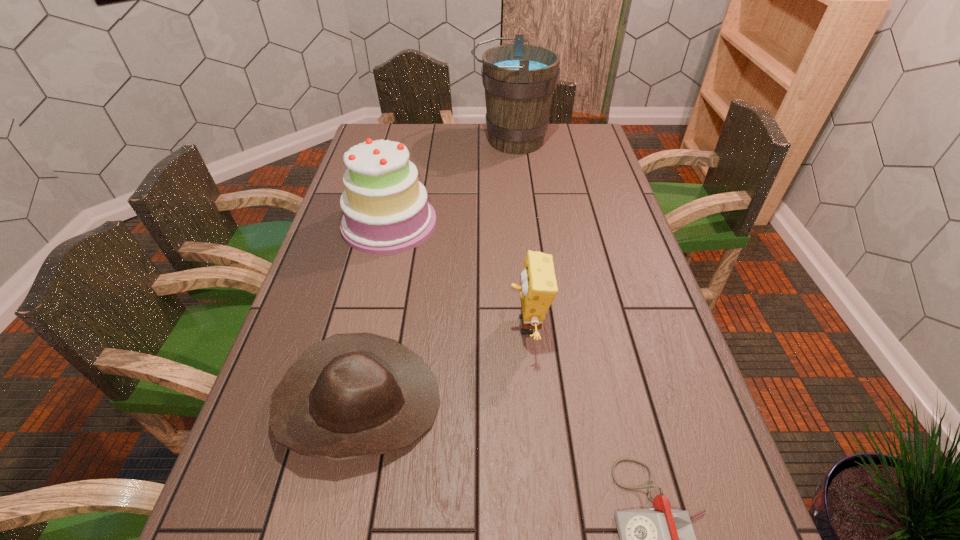
Where is `free space located 0.310m on the face of the third shortest object`? This screenshot has height=540, width=960. free space located 0.310m on the face of the third shortest object is located at coordinates point(381,325).

Image resolution: width=960 pixels, height=540 pixels. Find the location of `blank area located on the face of the third shortest object`. blank area located on the face of the third shortest object is located at coordinates (390, 325).

Find the location of a particular element. The width and height of the screenshot is (960, 540). vacant space situated on the face of the third shortest object is located at coordinates (471, 325).

The height and width of the screenshot is (540, 960). Identify the location of blank space located 0.110m on the back of the cowboy hat. (378, 311).

I want to click on object present at the far edge, so click(x=519, y=79).

This screenshot has width=960, height=540. Identify the location of cake located in the left edge section of the desktop. (386, 211).

This screenshot has width=960, height=540. Find the location of `cowboy hat at the left edge`. cowboy hat at the left edge is located at coordinates click(x=354, y=395).

Find the location of a particular element. This screenshot has width=960, height=540. vacant space at the far edge of the desktop is located at coordinates (484, 139).

In the image, there is a desktop. Identify the location of vacant space at the right edge. This screenshot has width=960, height=540. (650, 442).

Where is `empty location between the cake and the tallest object`? empty location between the cake and the tallest object is located at coordinates (450, 182).